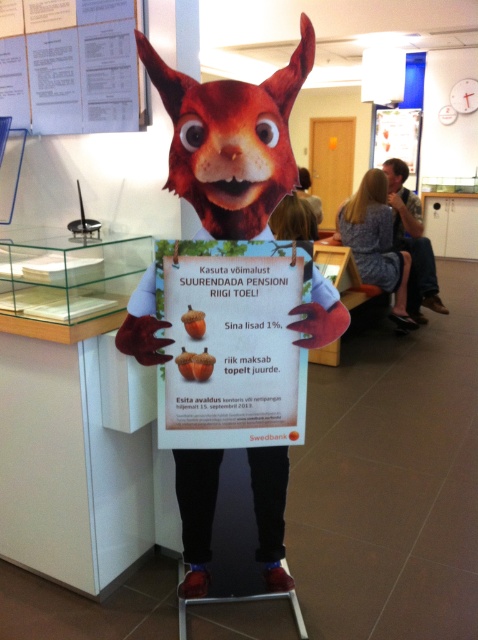
You are a visitor in a room with a life sized cardboard cutout of a squirrel holding a sign. You notice two items in the room, the matte orange poster at center and the denim jacket at upper right. Which item is larger in size?

The denim jacket at upper right is larger in size than the matte orange poster at center.

Based on the scene description, where is the blonde hair at upper right located in terms of coordinates?

The blonde hair at upper right is located at coordinates point (376, 243).